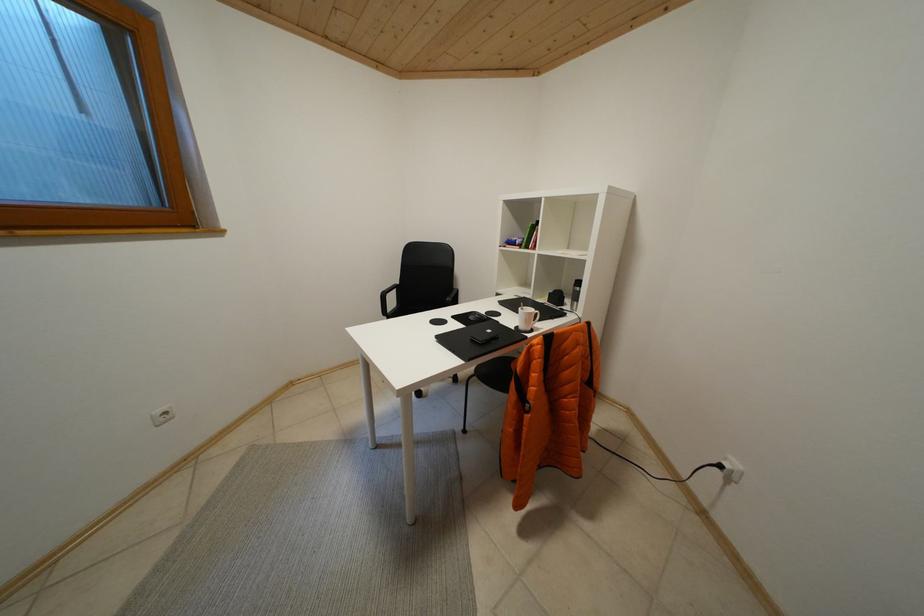
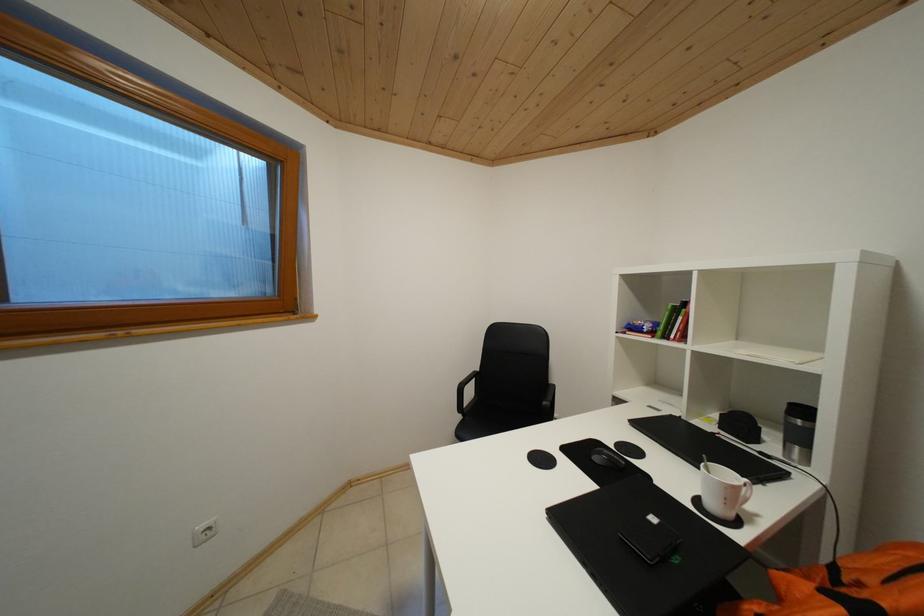
Which direction would the cameraman need to move to produce the second image?

The movement direction of the cameraman is left, forward.